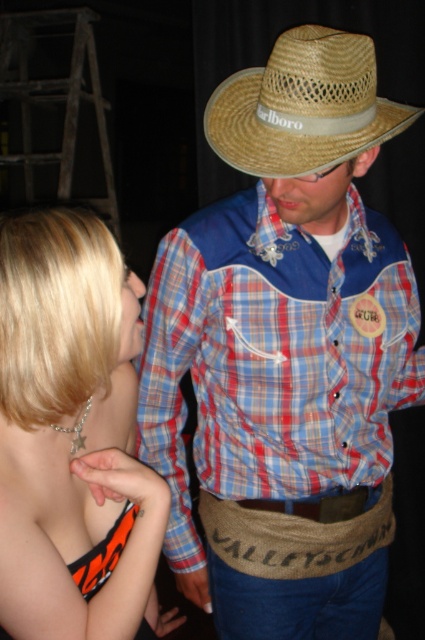
You are standing in the room and want to reach the point marked at coordinates (405, 120). If your arm can reach 1 meter, can you touch it without moving your feet?

The point at coordinates (405, 120) is 96.79 centimeters away from you, so yes, you can touch it with your arm since it is within your reach of 1 meter.

You are a photographer trying to capture a closeup of the shiny silver necklace at upper left without the matte straw cowboy hat at center blocking it. Is this possible?

The matte straw cowboy hat at center is positioned over the shiny silver necklace at upper left, so it will block the view. You need to adjust the angle or move the hat to capture the necklace without obstruction.